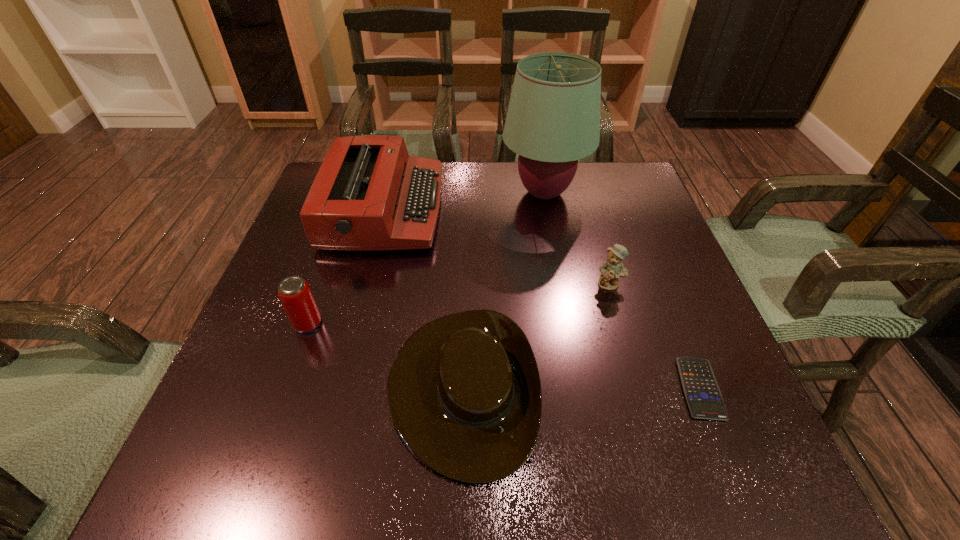
What are the coordinates of `empty space that is in between the fourth nearest object and the tallest object` in the screenshot? It's located at (577, 238).

Locate an element on the screen. The height and width of the screenshot is (540, 960). free spot between the calculator and the teddy bear is located at coordinates (655, 336).

You are a GUI agent. You are given a task and a screenshot of the screen. Output one action in this format:
    pyautogui.click(x=<x>, y=<y>)
    Task: Click on the vacant space in between the lampshade and the teddy bear
    This screenshot has height=540, width=960.
    Given the screenshot: What is the action you would take?
    pyautogui.click(x=577, y=238)

Image resolution: width=960 pixels, height=540 pixels. Find the location of `vacant point located between the third farthest object and the beer can`. vacant point located between the third farthest object and the beer can is located at coordinates pyautogui.click(x=459, y=303).

You are a GUI agent. You are given a task and a screenshot of the screen. Output one action in this format:
    pyautogui.click(x=<x>, y=<y>)
    Task: Click on the free point between the teddy bear and the typewriter
    
    Given the screenshot: What is the action you would take?
    pyautogui.click(x=497, y=246)

What are the coordinates of `vacant region between the second shortest object and the rightmost object` in the screenshot? It's located at (581, 388).

Identify the location of free area in between the fourth nearest object and the fifth tallest object. This screenshot has height=540, width=960. (536, 335).

Find the location of a particular element. The width and height of the screenshot is (960, 540). object that is the third closest to the typewriter is located at coordinates (464, 393).

Image resolution: width=960 pixels, height=540 pixels. Find the location of `object that is the fifth closest one to the beer can`. object that is the fifth closest one to the beer can is located at coordinates (701, 390).

The width and height of the screenshot is (960, 540). What are the coordinates of `free location that satisfies the following two spatial constraints: 1. on the typing side of the fifth tallest object; 2. on the right side of the typewriter` in the screenshot? It's located at (339, 387).